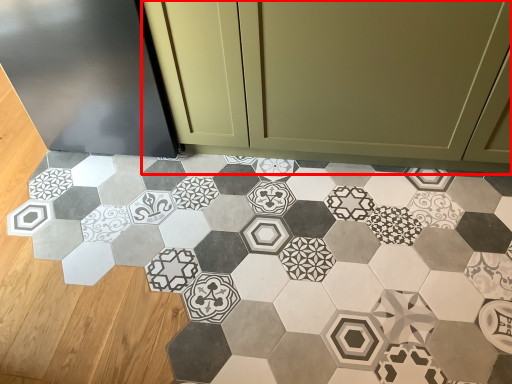
Question: From the image's perspective, considering the relative positions of cabinetry (annotated by the red box) and porcelain in the image provided, where is cabinetry (annotated by the red box) located with respect to the staircase?

Choices:
 (A) below
 (B) above

Answer: (B)